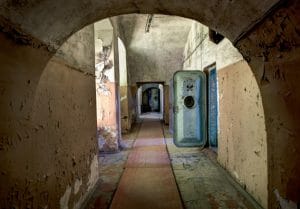
Where is `wall`? wall is located at coordinates (63, 103), (247, 106), (116, 85), (130, 83), (189, 62).